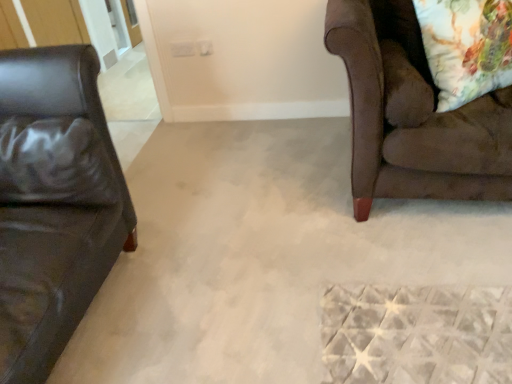
Question: Should I look upward or downward to see floral fabric pillow at upper right?

Choices:
 (A) down
 (B) up

Answer: (B)

Question: Considering the relative positions of black leather pillow at left and floral fabric pillow at upper right in the image provided, is black leather pillow at left behind floral fabric pillow at upper right?

Choices:
 (A) no
 (B) yes

Answer: (A)

Question: Could floral fabric pillow at upper right be considered to be inside black leather pillow at left?

Choices:
 (A) yes
 (B) no

Answer: (B)

Question: Is floral fabric pillow at upper right at the back of black leather pillow at left?

Choices:
 (A) no
 (B) yes

Answer: (A)

Question: Considering the relative sizes of black leather pillow at left and floral fabric pillow at upper right in the image provided, is black leather pillow at left bigger than floral fabric pillow at upper right?

Choices:
 (A) yes
 (B) no

Answer: (B)

Question: Considering the relative sizes of black leather pillow at left and floral fabric pillow at upper right in the image provided, is black leather pillow at left smaller than floral fabric pillow at upper right?

Choices:
 (A) no
 (B) yes

Answer: (B)

Question: Is black leather pillow at left in contact with floral fabric pillow at upper right?

Choices:
 (A) no
 (B) yes

Answer: (A)

Question: Is floral fabric pillow at upper right shorter than black leather pillow at left?

Choices:
 (A) yes
 (B) no

Answer: (B)

Question: From a real-world perspective, is floral fabric pillow at upper right on black leather pillow at left?

Choices:
 (A) yes
 (B) no

Answer: (A)

Question: Is floral fabric pillow at upper right closer to the viewer compared to black leather pillow at left?

Choices:
 (A) no
 (B) yes

Answer: (A)

Question: Is floral fabric pillow at upper right located outside black leather pillow at left?

Choices:
 (A) yes
 (B) no

Answer: (A)

Question: Is floral fabric pillow at upper right at the left side of black leather pillow at left?

Choices:
 (A) no
 (B) yes

Answer: (A)

Question: Is there a large distance between floral fabric pillow at upper right and black leather pillow at left?

Choices:
 (A) no
 (B) yes

Answer: (B)

Question: Is black leather pillow at left positioned far away from brown suede couch at right?

Choices:
 (A) no
 (B) yes

Answer: (B)